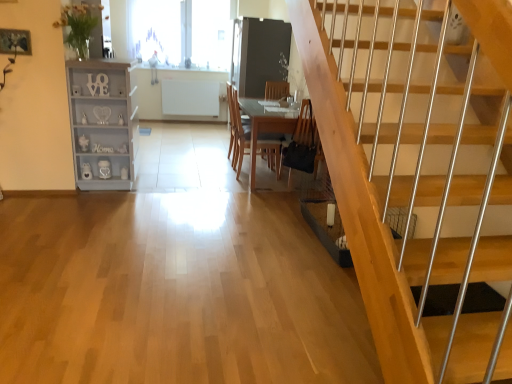
At what (x,y) coordinates should I click in order to perform the action: click on black leather chair at lower center. Please return your answer as a coordinate pair (x, y). The image size is (512, 384). Looking at the image, I should click on [x=303, y=144].

Measure the distance between point (266, 69) and camera.

The depth of point (266, 69) is 6.46 meters.

Where is `wooden chair at center`? This screenshot has height=384, width=512. wooden chair at center is located at coordinates (237, 131).

Measure the distance between transparent glass window at upper center, positioned as the first window in back-to-front order, and camera.

transparent glass window at upper center, positioned as the first window in back-to-front order, is 6.71 meters from camera.

What do you see at coordinates (181, 31) in the screenshot? I see `transparent glass window at upper center, the second window viewed from the front` at bounding box center [181, 31].

Locate an element on the screen. This screenshot has width=512, height=384. transparent glass window at upper center, which ranks as the second window in back-to-front order is located at coordinates (155, 30).

From the image's perspective, does transparent glass window at upper center, positioned as the first window in back-to-front order, appear lower than matte black glass door at center?

Incorrect, from the image's perspective, transparent glass window at upper center, positioned as the first window in back-to-front order, is higher than matte black glass door at center.

What are the coordinates of `the 2nd window directly above the matte black glass door at center (from a real-world perspective)` in the screenshot? It's located at (181, 31).

Looking at this image, can you confirm if transparent glass window at upper center, the second window viewed from the front, is taller than wooden table at center?

Correct, transparent glass window at upper center, the second window viewed from the front, is much taller as wooden table at center.

Does transparent glass window at upper center, positioned as the first window in back-to-front order, lie in front of wooden table at center?

No, transparent glass window at upper center, positioned as the first window in back-to-front order, is behind wooden table at center.

Does transparent glass window at upper center, positioned as the first window in back-to-front order, have a greater width compared to wooden table at center?

No, transparent glass window at upper center, positioned as the first window in back-to-front order, is not wider than wooden table at center.

Is transparent glass window at upper center, the second window viewed from the front, to the right of wooden table at center from the viewer's perspective?

No.

Who is bigger, wooden chair at center or white painted wood shelf at left?

white painted wood shelf at left.

Is point (271, 167) positioned behind point (106, 88)?

Yes.

Measure the distance between wooden chair at center and white painted wood shelf at left.

wooden chair at center and white painted wood shelf at left are 1.40 meters apart from each other.

Can you confirm if wooden chair at center is positioned to the right of white painted wood shelf at left?

Yes.

Is black leather chair at lower center bigger than white painted wood shelf at left?

No.

From a real-world perspective, is black leather chair at lower center positioned above or below white painted wood shelf at left?

Clearly, from a real-world perspective, black leather chair at lower center is above white painted wood shelf at left.

Measure the distance between black leather chair at lower center and white painted wood shelf at left.

1.76 meters.

Is black leather chair at lower center facing away from white painted wood shelf at left?

black leather chair at lower center does not have its back to white painted wood shelf at left.

Measure the distance from transparent glass window at upper center, the 1th window in the front-to-back sequence, to wooden chair at center.

transparent glass window at upper center, the 1th window in the front-to-back sequence, and wooden chair at center are 2.40 meters apart.

Who is shorter, transparent glass window at upper center, which ranks as the second window in back-to-front order, or wooden chair at center?

With less height is wooden chair at center.

I want to click on the 1st window behind when counting from the wooden chair at center, so click(x=155, y=30).

Is transparent glass window at upper center, positioned as the first window in back-to-front order, not inside wooden chair at center?

transparent glass window at upper center, positioned as the first window in back-to-front order, is positioned outside wooden chair at center.

From a real-world perspective, is transparent glass window at upper center, positioned as the first window in back-to-front order, above or below wooden chair at center?

In terms of real-world spatial position, transparent glass window at upper center, positioned as the first window in back-to-front order, is above wooden chair at center.

Is transparent glass window at upper center, positioned as the first window in back-to-front order, turned away from wooden chair at center?

No, transparent glass window at upper center, positioned as the first window in back-to-front order, is not facing the opposite direction of wooden chair at center.

Looking at this image, is transparent glass window at upper center, the second window viewed from the front, to the left or to the right of wooden chair at center in the image?

transparent glass window at upper center, the second window viewed from the front, is to the left of wooden chair at center.

Who is bigger, transparent glass window at upper center, the second window viewed from the front, or white painted wood shelf at left?

white painted wood shelf at left is bigger.

Is transparent glass window at upper center, positioned as the first window in back-to-front order, to the left or to the right of white painted wood shelf at left in the image?

transparent glass window at upper center, positioned as the first window in back-to-front order, is positioned on white painted wood shelf at left's right side.

Relative to white painted wood shelf at left, is transparent glass window at upper center, positioned as the first window in back-to-front order, in front or behind?

transparent glass window at upper center, positioned as the first window in back-to-front order, is behind white painted wood shelf at left.

Is transparent glass window at upper center, the second window viewed from the front, not near white painted wood shelf at left?

transparent glass window at upper center, the second window viewed from the front, is far away from white painted wood shelf at left.

Locate an element on the screen. This screenshot has height=384, width=512. glass door below the transparent glass window at upper center, positioned as the first window in back-to-front order (from a real-world perspective) is located at coordinates (258, 54).

Where is `table that is in front of the transparent glass window at upper center, the second window viewed from the front`? table that is in front of the transparent glass window at upper center, the second window viewed from the front is located at coordinates (264, 128).

Considering their positions, is white painted wood shelf at left positioned closer to transparent glass window at upper center, the second window viewed from the front, than matte black glass door at center?

matte black glass door at center lies closer to transparent glass window at upper center, the second window viewed from the front, than the other object.

Which object lies further to the anchor point white painted wood shelf at left, wooden table at center or black leather chair at lower center?

black leather chair at lower center.

When comparing their distances from transparent glass window at upper center, which ranks as the second window in back-to-front order, does wooden chair at center or wooden table at center seem further?

The object further to transparent glass window at upper center, which ranks as the second window in back-to-front order, is wooden table at center.

Considering their positions, is black leather chair at lower center positioned closer to matte black glass door at center than white painted wood shelf at left?

black leather chair at lower center is positioned closer to the anchor matte black glass door at center.

Considering their positions, is black leather chair at lower center positioned closer to transparent glass window at upper center, the 1th window in the front-to-back sequence, than wooden chair at center?

→ wooden chair at center is closer to transparent glass window at upper center, the 1th window in the front-to-back sequence.

When comparing their distances from matte black glass door at center, does transparent glass window at upper center, the second window viewed from the front, or black leather chair at lower center seem closer?

transparent glass window at upper center, the second window viewed from the front.

Considering their positions, is wooden table at center positioned closer to wooden chair at center than matte black glass door at center?

wooden table at center is closer to wooden chair at center.

When comparing their distances from matte black glass door at center, does transparent glass window at upper center, positioned as the first window in back-to-front order, or wooden chair at center seem further?

wooden chair at center.

Identify the location of glass door between white painted wood shelf at left and transparent glass window at upper center, the 1th window in the front-to-back sequence, in the front-back direction. This screenshot has height=384, width=512. (258, 54).

Identify the location of table between white painted wood shelf at left and black leather chair at lower center. (264, 128).

Locate an element on the screen. table positioned between white painted wood shelf at left and transparent glass window at upper center, the second window viewed from the front, from near to far is located at coordinates (264, 128).

Locate an element on the screen. This screenshot has width=512, height=384. window positioned between black leather chair at lower center and transparent glass window at upper center, positioned as the first window in back-to-front order, from near to far is located at coordinates (155, 30).